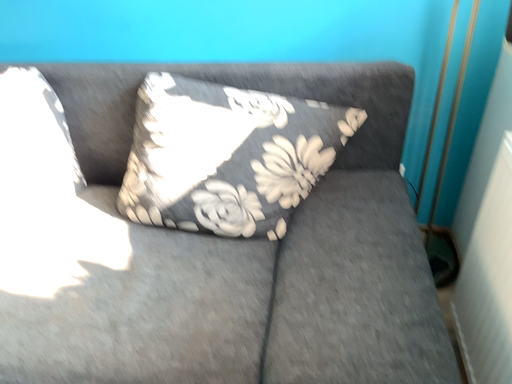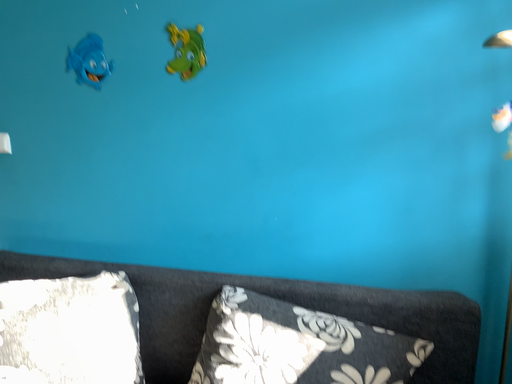
Question: How did the camera likely rotate when shooting the video?

Choices:
 (A) rotated upward
 (B) rotated downward

Answer: (A)